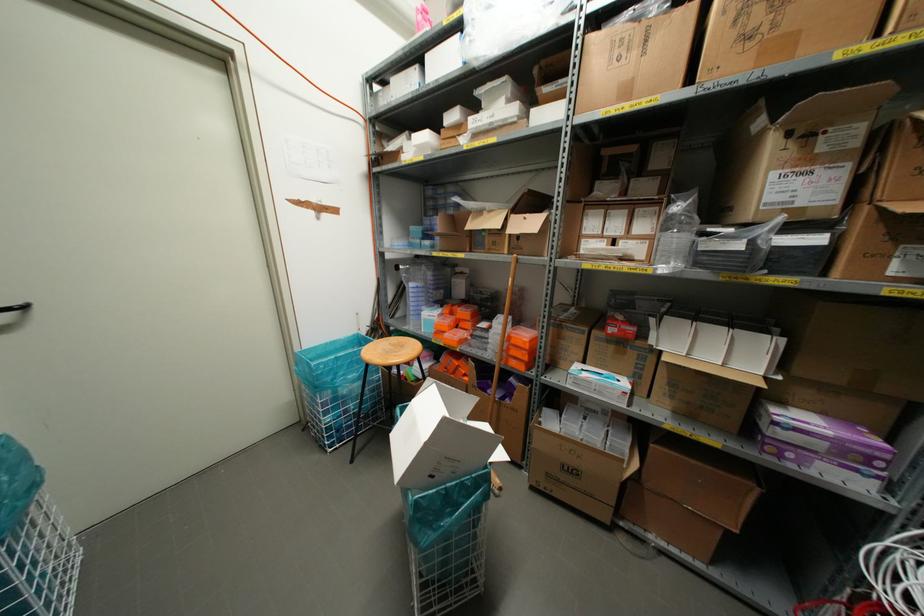
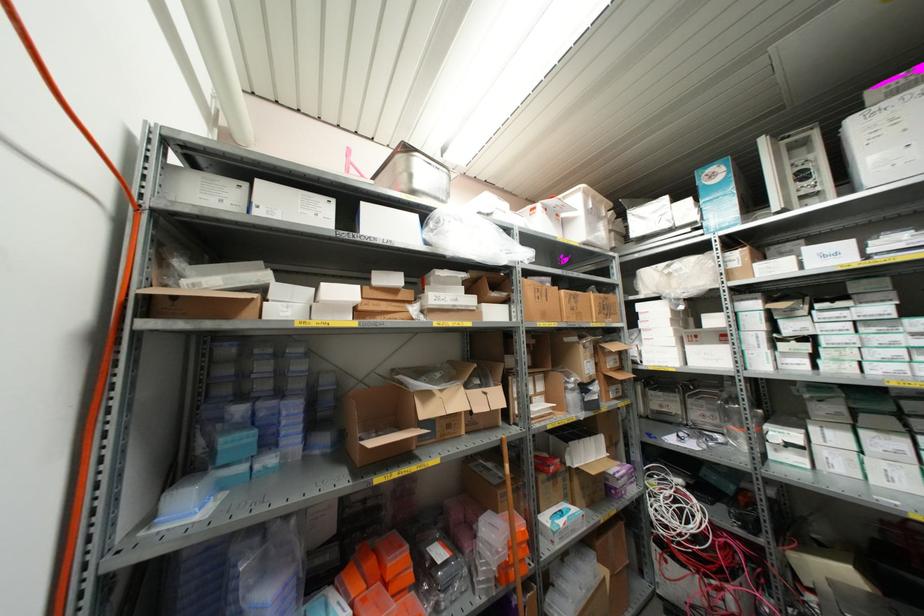
Find the pixel in the second image that matches (x=638, y=39) in the first image.

(542, 292)